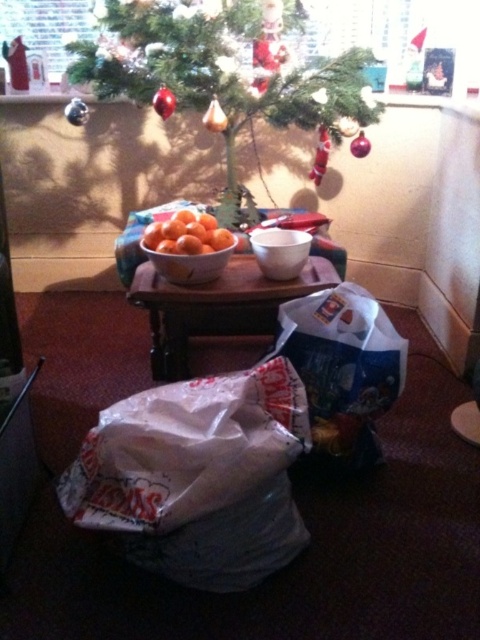
Between orange matte bowl at center and orange matte/orange at center, which one is positioned higher?

Positioned higher is orange matte bowl at center.

Find the location of a particular element. Image resolution: width=480 pixels, height=640 pixels. orange matte bowl at center is located at coordinates (187, 234).

What do you see at coordinates (187, 234) in the screenshot? The image size is (480, 640). I see `orange matte bowl at center` at bounding box center [187, 234].

Where is `orange matte bowl at center`? The image size is (480, 640). orange matte bowl at center is located at coordinates (187, 234).

Is green textured christmas tree at center closer to camera compared to wooden table at center?

That is False.

Does green textured christmas tree at center have a lesser width compared to wooden table at center?

Incorrect, green textured christmas tree at center's width is not less than wooden table at center's.

Does point (170, 20) come farther from viewer compared to point (220, 304)?

Yes, point (170, 20) is farther from viewer.

This screenshot has height=640, width=480. In order to click on green textured christmas tree at center in this screenshot , I will do `click(218, 76)`.

Which is above, green textured christmas tree at center or orange matte/orange at center?

green textured christmas tree at center

Image resolution: width=480 pixels, height=640 pixels. I want to click on green textured christmas tree at center, so click(218, 76).

Between point (250, 100) and point (201, 244), which one is positioned in front?

Positioned in front is point (201, 244).

Where is `green textured christmas tree at center`? The height and width of the screenshot is (640, 480). green textured christmas tree at center is located at coordinates (218, 76).